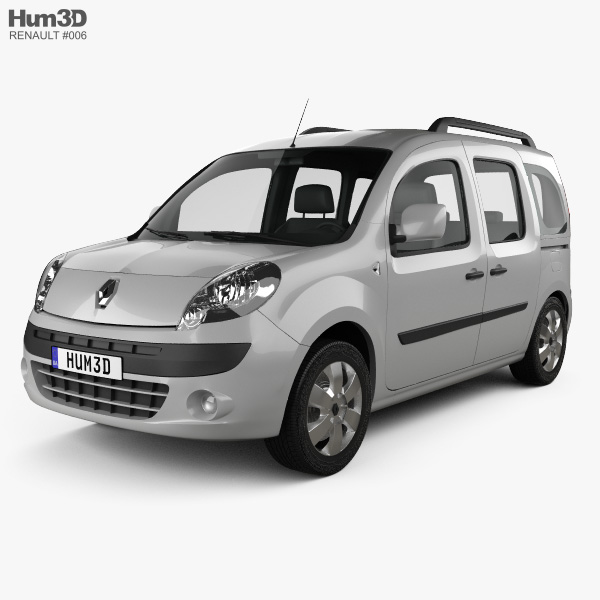
The height and width of the screenshot is (600, 600). Find the location of `windows`. windows is located at coordinates (441, 187), (501, 201), (550, 184).